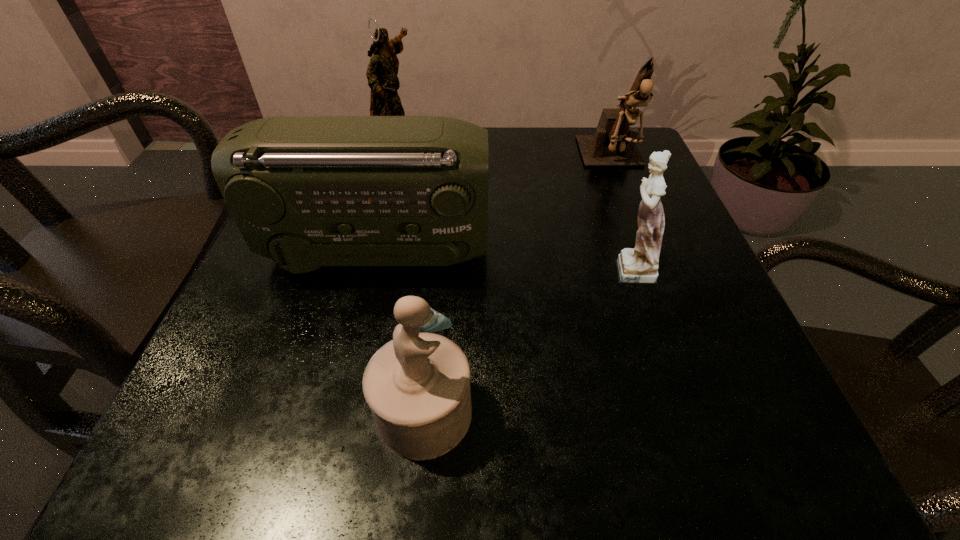
Where is `radio_receiver present at the left edge`? Image resolution: width=960 pixels, height=540 pixels. radio_receiver present at the left edge is located at coordinates (304, 191).

Where is `object located in the far left corner section of the desktop`? object located in the far left corner section of the desktop is located at coordinates (382, 71).

The width and height of the screenshot is (960, 540). Find the location of `object that is at the far right corner`. object that is at the far right corner is located at coordinates (614, 144).

In the image, there is a desktop. Identify the location of vacant region at the near edge. The height and width of the screenshot is (540, 960). (455, 471).

In order to click on vacant space at the left edge of the desktop in this screenshot , I will do `click(228, 339)`.

Where is `vacant space at the right edge of the desktop`? Image resolution: width=960 pixels, height=540 pixels. vacant space at the right edge of the desktop is located at coordinates (624, 201).

Where is `free location at the near left corner`? The height and width of the screenshot is (540, 960). free location at the near left corner is located at coordinates (197, 452).

Where is `vacant position at the far right corner of the desktop`? Image resolution: width=960 pixels, height=540 pixels. vacant position at the far right corner of the desktop is located at coordinates (610, 174).

Image resolution: width=960 pixels, height=540 pixels. Find the location of `vacant space in between the radio_receiver and the third farthest figurine`. vacant space in between the radio_receiver and the third farthest figurine is located at coordinates [503, 260].

Select which object is the second closest to the third farthest figurine. Please provide its 2D coordinates. Your answer should be formatted as a tuple, i.e. [(x, y)], where the tuple contains the x and y coordinates of a point satisfying the conditions above.

[(304, 191)]